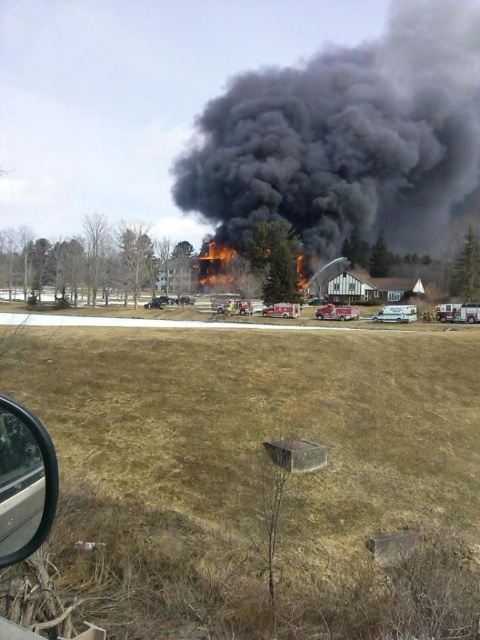
Question: Can you confirm if transparent glass car window at lower left is positioned below red metallic fire truck at center?

Choices:
 (A) yes
 (B) no

Answer: (A)

Question: Does white matte van at center come in front of metallic silver fire truck at center?

Choices:
 (A) yes
 (B) no

Answer: (A)

Question: Which of the following is the farthest from the observer?

Choices:
 (A) white matte van at center
 (B) red metallic fire truck at center

Answer: (B)

Question: Based on their relative distances, which object is farther from the metallic silver fire truck at center?

Choices:
 (A) white matte van at center
 (B) black smoke at upper center

Answer: (B)

Question: Is red metallic fire truck at center to the right of metallic silver fire truck at center from the viewer's perspective?

Choices:
 (A) yes
 (B) no

Answer: (A)

Question: Which of the following is the farthest from the observer?

Choices:
 (A) black smoke at upper center
 (B) red metallic fire truck at center
 (C) transparent glass car window at lower left
 (D) metallic silver fire truck at center

Answer: (A)